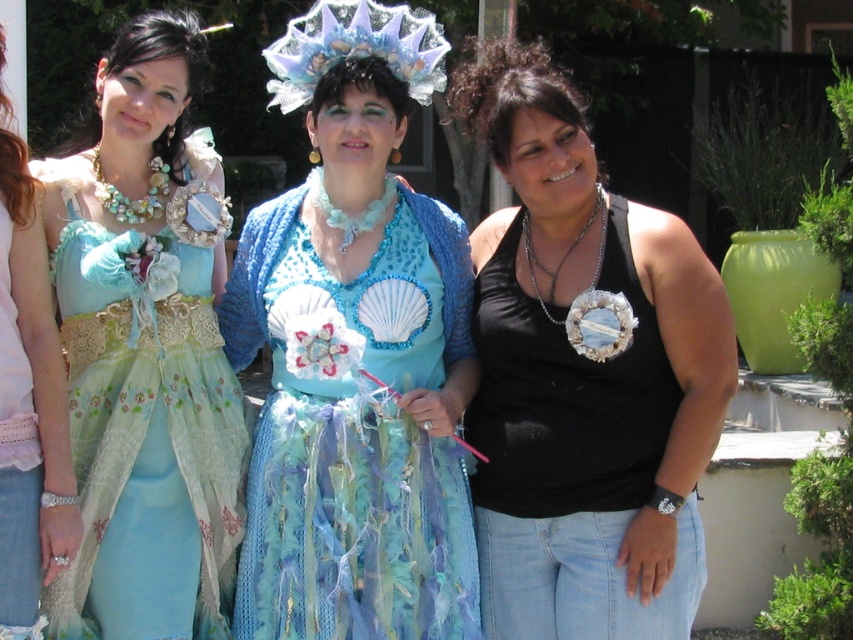
Question: Which point appears farthest from the camera in this image?

Choices:
 (A) (270, 49)
 (B) (51, 440)
 (C) (230, 412)
 (D) (635, 252)

Answer: (A)

Question: Which point is farther to the camera?

Choices:
 (A) matte blue dress at left
 (B) matte blue fabric dress at left
 (C) shiny blue fabric dress at center

Answer: (C)

Question: Does matte blue dress at left have a larger size compared to iridescent fabric headdress at center?

Choices:
 (A) no
 (B) yes

Answer: (B)

Question: Is shiny blue fabric dress at center further to camera compared to matte blue fabric dress at left?

Choices:
 (A) yes
 (B) no

Answer: (A)

Question: Is shiny blue fabric dress at center to the left of matte blue fabric dress at left from the viewer's perspective?

Choices:
 (A) yes
 (B) no

Answer: (B)

Question: Which point is farther to the camera?

Choices:
 (A) (236, 412)
 (B) (321, 49)
 (C) (722, 396)

Answer: (A)